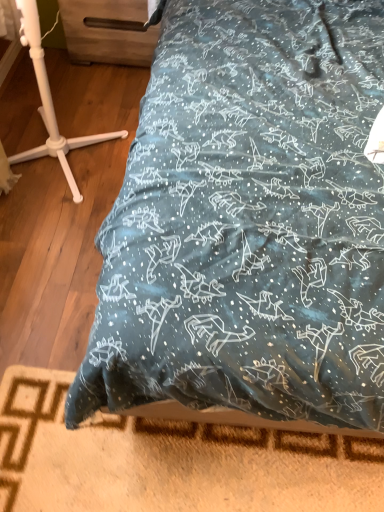
The image size is (384, 512). I want to click on space that is in front of white plastic tripod at left, so click(x=45, y=239).